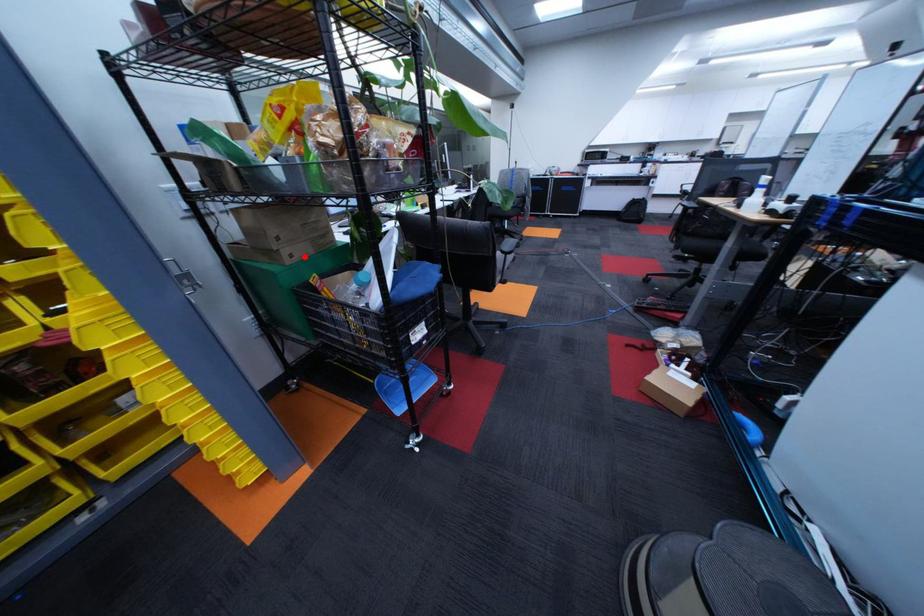
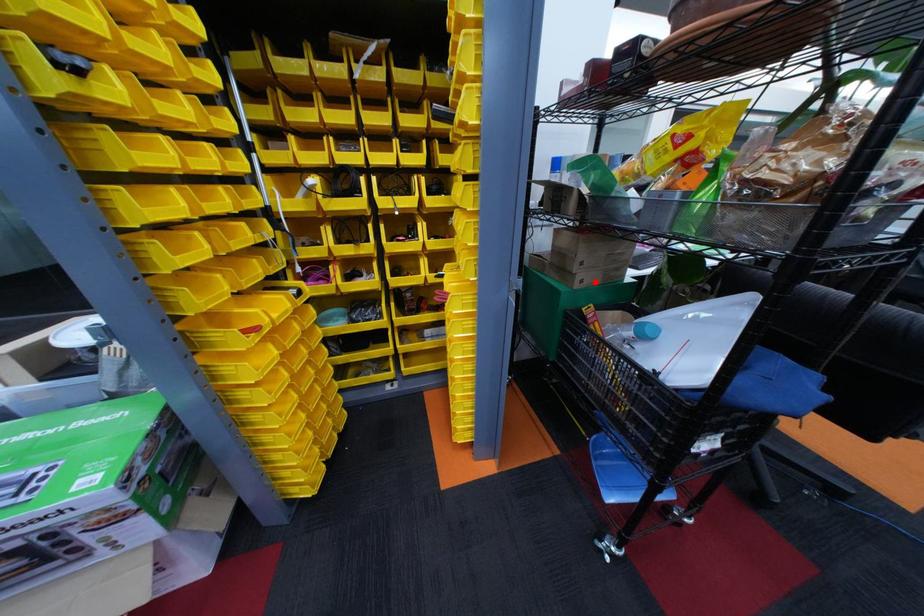
I am providing you with two images of the same scene from different viewpoints. A red point is marked on the first image and another point is marked on the second image. Is the marked point in image1 the same physical position as the marked point in image2?

Yes